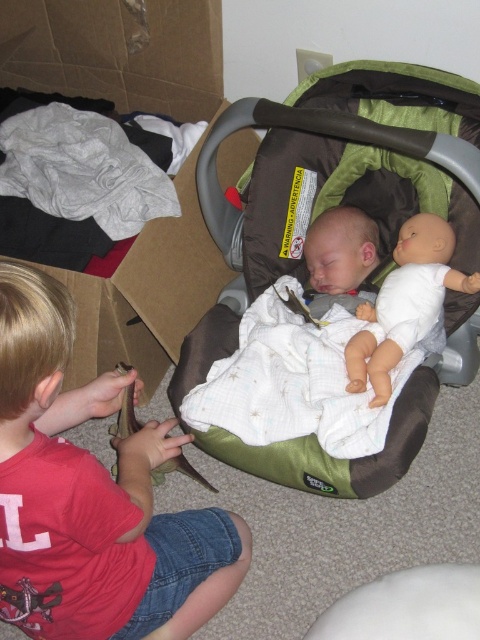
You are a parent who wants to place a brown cardboard box at upper left on a shelf that is 1.2 meters away from you. Can you reach the shelf with the box?

The brown cardboard box at upper left and viewer are 1.18 meters apart from each other, so the box can be placed on the shelf since it is within reach.

You are a parent trying to store the baby doll and car seat. You have a brown cardboard box at upper left and a gray cotton cloth at upper left. Which container can you use to store both items without overlapping?

The brown cardboard box at upper left might be wider than gray cotton cloth at upper left, so it is more likely to accommodate both the baby doll and car seat without overlapping.